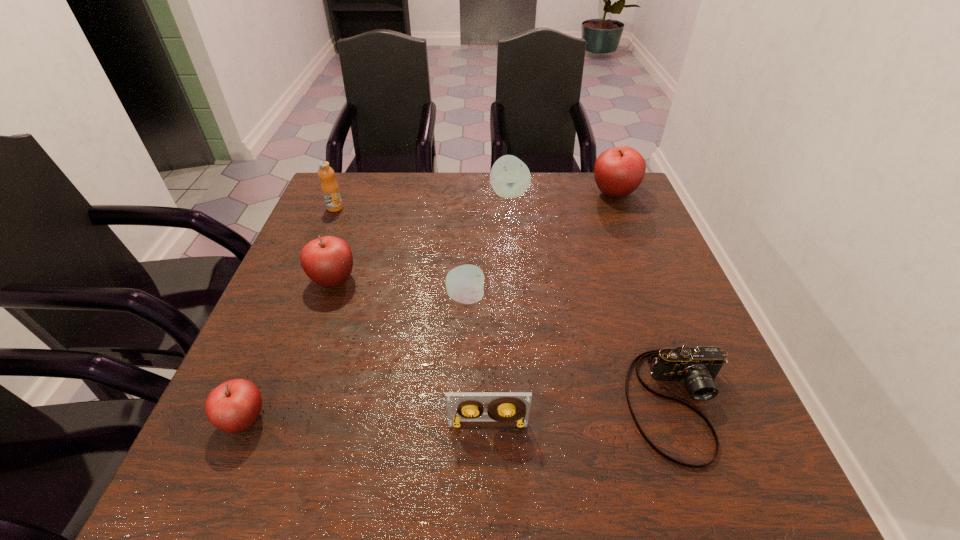
Locate an element on the screen. The image size is (960, 540). brown videotape is located at coordinates (463, 408).

Identify the location of camera. Image resolution: width=960 pixels, height=540 pixels. (697, 367).

This screenshot has height=540, width=960. Find the location of `brown camera`. brown camera is located at coordinates (697, 367).

Where is `free region located on the left of the rightmost apple`? Image resolution: width=960 pixels, height=540 pixels. free region located on the left of the rightmost apple is located at coordinates (484, 193).

I want to click on vacant region located 0.340m on the front label of the orange juice, so click(297, 299).

Image resolution: width=960 pixels, height=540 pixels. Find the location of `vacant space located 0.060m on the left of the bigger white apple`. vacant space located 0.060m on the left of the bigger white apple is located at coordinates (469, 194).

Where is `free spot located 0.180m on the front of the second smallest red apple`? Image resolution: width=960 pixels, height=540 pixels. free spot located 0.180m on the front of the second smallest red apple is located at coordinates (304, 361).

Locate an element on the screen. The width and height of the screenshot is (960, 540). free space located 0.060m on the front of the left white apple is located at coordinates (465, 333).

Locate an element on the screen. Image resolution: width=960 pixels, height=540 pixels. free region located on the back of the nearest apple is located at coordinates (x=288, y=317).

Locate an element on the screen. The image size is (960, 540). free spot located 0.060m at the front of the videotape with visible reels is located at coordinates (489, 462).